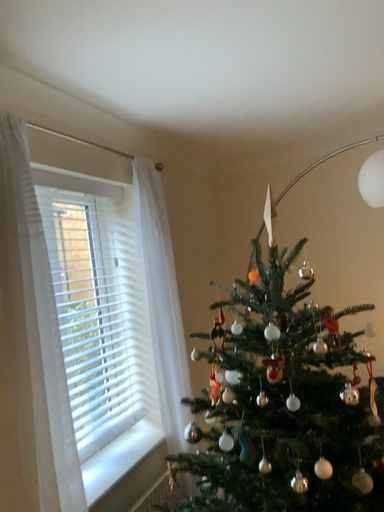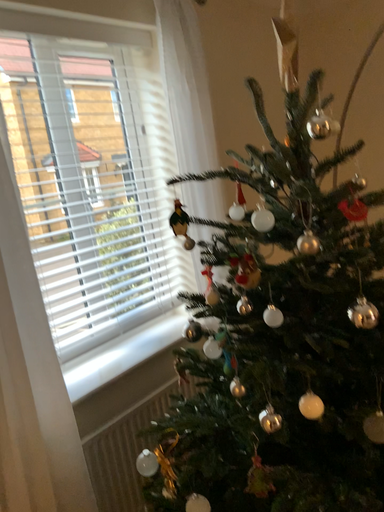
Question: Which way did the camera rotate in the video?

Choices:
 (A) rotated upward
 (B) rotated downward

Answer: (B)